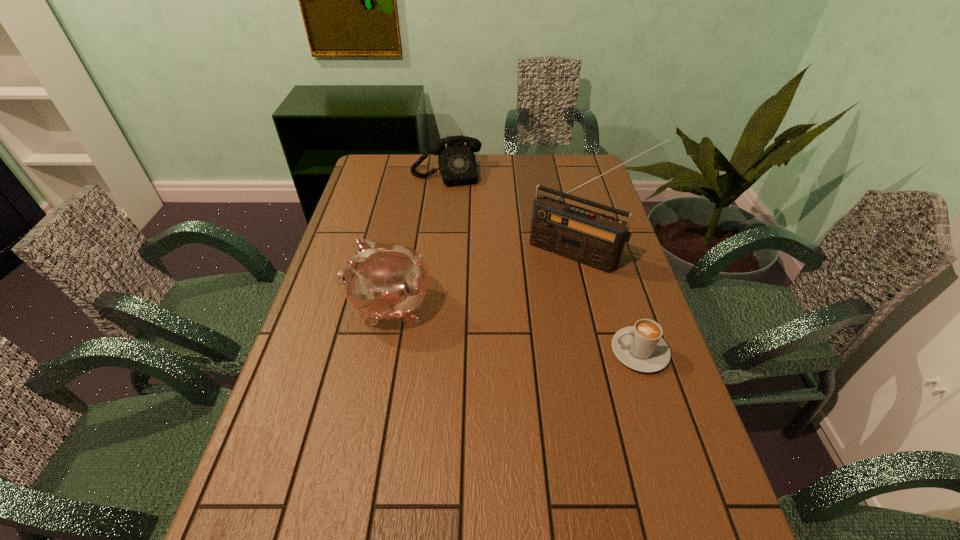
The height and width of the screenshot is (540, 960). I want to click on vacant space at the far edge of the desktop, so click(420, 165).

Identify the location of free space at the near edge. The image size is (960, 540). (360, 492).

Where is `free space at the left edge of the desktop`? free space at the left edge of the desktop is located at coordinates (389, 191).

In the image, there is a desktop. Identify the location of vacant area at the right edge. This screenshot has height=540, width=960. (612, 335).

Identify the location of vacant space at the far left corner of the desktop. The image size is (960, 540). (388, 177).

At what (x,y) coordinates should I click in order to perform the action: click on free space at the near right corner of the desktop. Please return your answer as a coordinate pair (x, y). This screenshot has height=540, width=960. Looking at the image, I should click on (661, 494).

Where is `vacant region between the shortest object and the third tallest object`? vacant region between the shortest object and the third tallest object is located at coordinates (543, 262).

The image size is (960, 540). Find the location of `vacant region between the telephone and the piggy bank`. vacant region between the telephone and the piggy bank is located at coordinates (418, 240).

This screenshot has width=960, height=540. What are the coordinates of `vacant area that lies between the second shortest object and the cappuccino` in the screenshot? It's located at (543, 262).

This screenshot has width=960, height=540. I want to click on free space between the cappuccino and the farthest object, so click(543, 262).